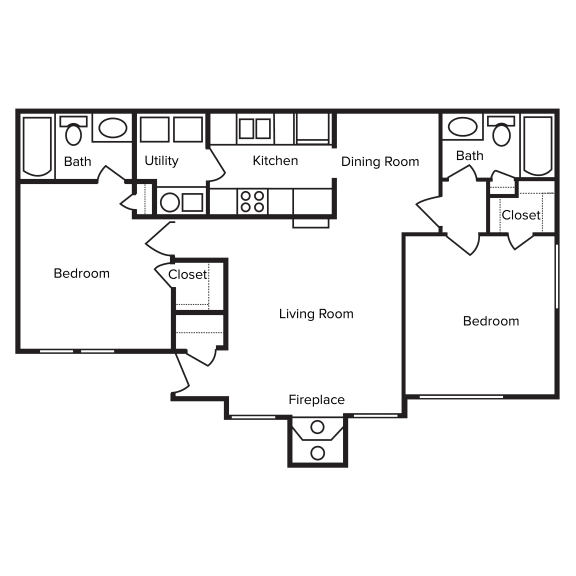
Image resolution: width=576 pixels, height=576 pixels. I want to click on tub, so click(541, 138), click(33, 146).